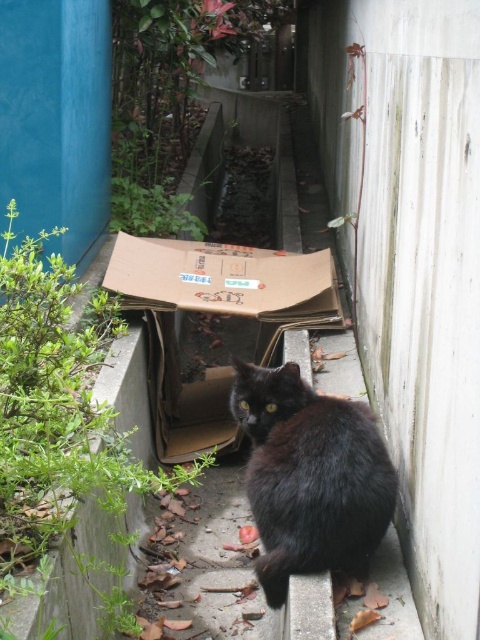
You are a delivery robot with a width of 1.5 meters. You need to navigate through the narrow alleyway to deliver a package. There is a black fur cat at center and a brown cardboard box at center in your path. Can you pass between them without moving either object?

The distance between the black fur cat at center and the brown cardboard box at center is 1.68 meters. Since your robot is 1.5 meters wide, you can pass between them as the space is slightly wider than your width.

You are navigating through the alleyway and need to determine the safest path. Which of the two points, point (314, 554) or point (133, 307), is closer to you?

Point (314, 554) is closer to the viewer than point (133, 307), so it is the closer point.